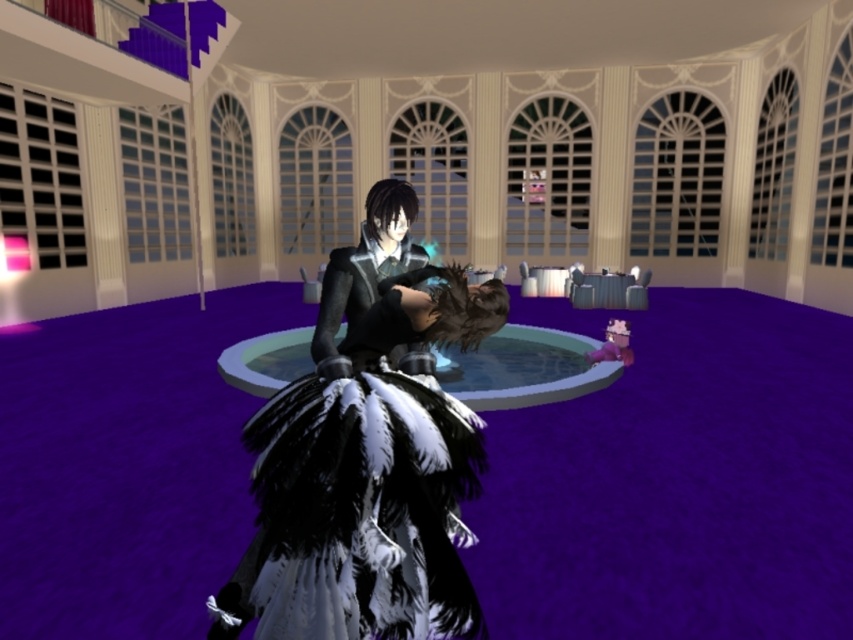
Question: Considering the real-world distances, which object is farthest from the feathered black dress at center?

Choices:
 (A) shiny black armor at center
 (B) shiny black dress at center

Answer: (B)

Question: Which of the following is the closest to the observer?

Choices:
 (A) feathered black dress at center
 (B) shiny black dress at center
 (C) shiny black armor at center

Answer: (A)

Question: Is feathered black dress at center to the right of shiny black dress at center from the viewer's perspective?

Choices:
 (A) yes
 (B) no

Answer: (B)

Question: Does feathered black dress at center have a smaller size compared to shiny black dress at center?

Choices:
 (A) no
 (B) yes

Answer: (A)

Question: Which point appears closest to the camera in this image?

Choices:
 (A) (376, 296)
 (B) (495, 339)
 (C) (281, 481)

Answer: (C)

Question: Is feathered black dress at center positioned in front of shiny black armor at center?

Choices:
 (A) yes
 (B) no

Answer: (A)